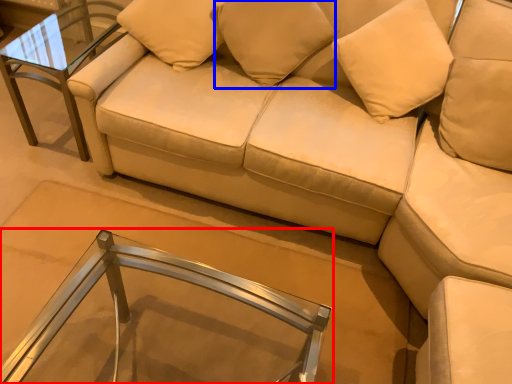
Question: Which of the following is the closest to the observer, table (highlighted by a red box) or pillow (highlighted by a blue box)?

Choices:
 (A) table
 (B) pillow

Answer: (A)